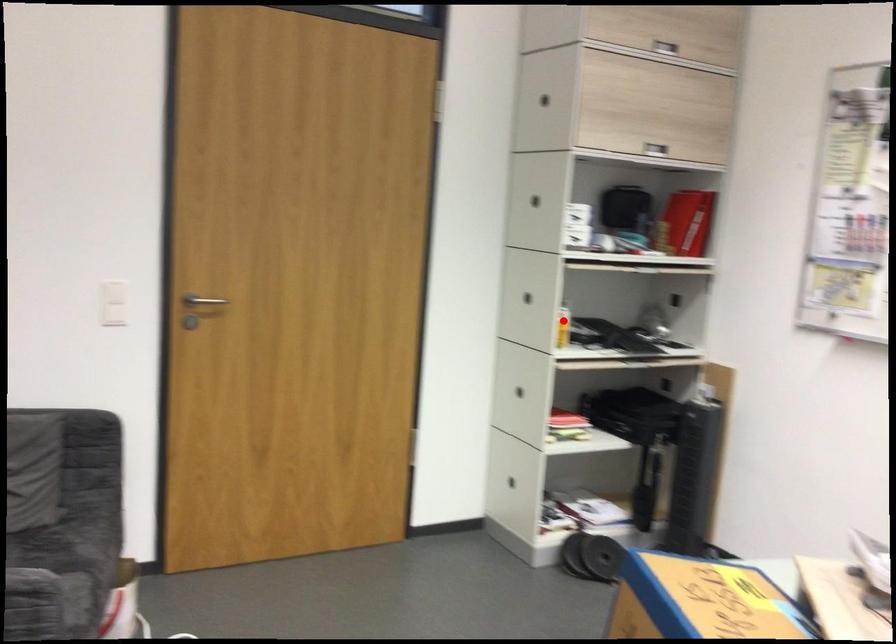
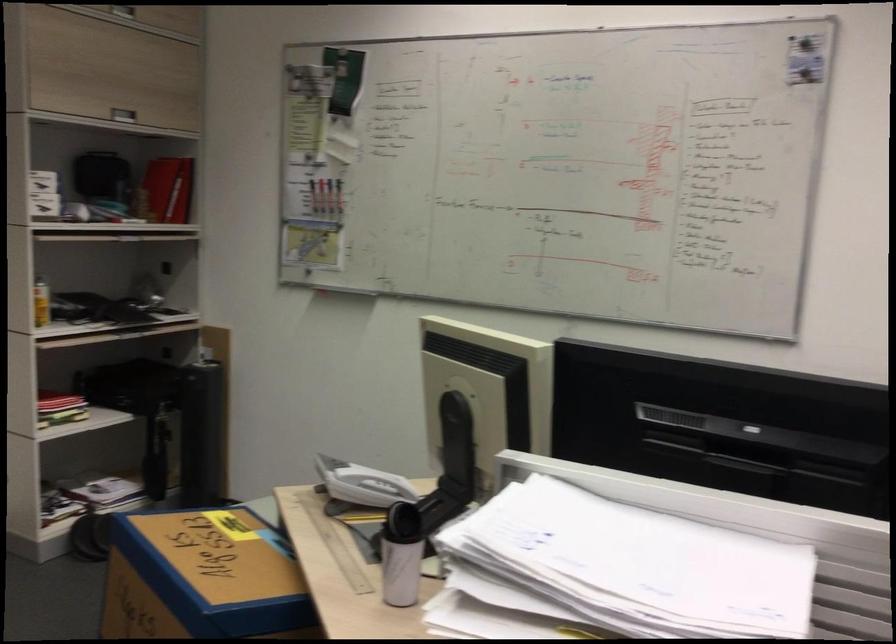
In the second image, find the point that corresponds to the highlighted location in the first image.

(40, 303)